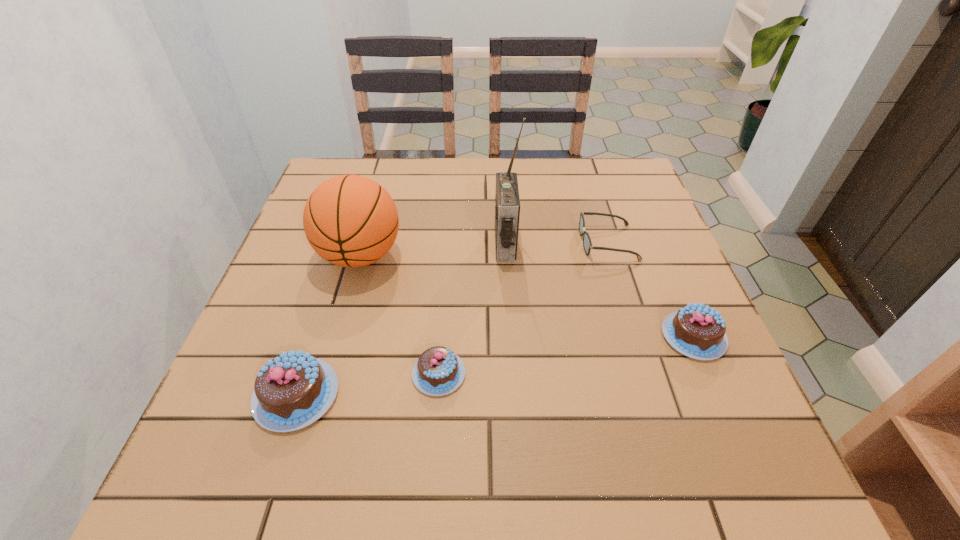
Identify the location of object that can be found as the third closest to the spectacles. (438, 371).

The image size is (960, 540). What are the coordinates of `chocolate cake that is the closest one to the second chocolate cake from right to left` in the screenshot? It's located at (293, 390).

Identify the location of chocolate cake that stands as the second closest to the second tallest object. The image size is (960, 540). click(293, 390).

Where is `vacant space that satisfies the following two spatial constraints: 1. on the display of the radio receiver; 2. on the front side of the leftmost chocolate cake`? The height and width of the screenshot is (540, 960). vacant space that satisfies the following two spatial constraints: 1. on the display of the radio receiver; 2. on the front side of the leftmost chocolate cake is located at coordinates (515, 395).

This screenshot has width=960, height=540. I want to click on vacant region that satisfies the following two spatial constraints: 1. on the face of the spectacles; 2. on the front side of the second chocolate cake from left to right, so [649, 374].

You are a GUI agent. You are given a task and a screenshot of the screen. Output one action in this format:
    pyautogui.click(x=<x>, y=<y>)
    Task: Click on the vacant region that satisfies the following two spatial constraints: 1. on the face of the spectacles; 2. on the back side of the fourth tallest object
    
    Given the screenshot: What is the action you would take?
    pyautogui.click(x=636, y=336)

At what (x,y) coordinates should I click in order to perform the action: click on free space that satisfies the following two spatial constraints: 1. on the face of the spectacles; 2. on the right side of the rightmost chocolate cake. Please return your answer as a coordinate pair (x, y). Image resolution: width=960 pixels, height=540 pixels. Looking at the image, I should click on (636, 336).